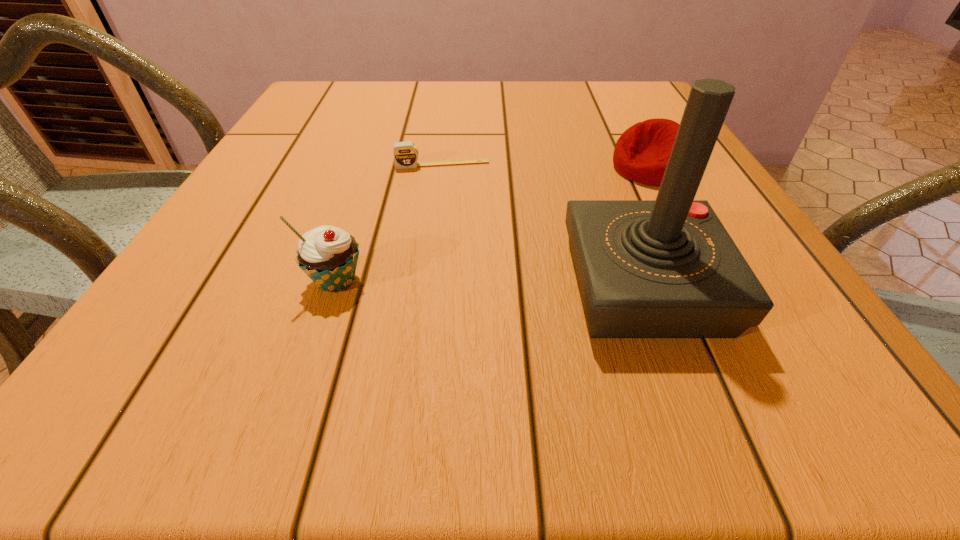
The height and width of the screenshot is (540, 960). I want to click on vacant space at the near edge of the desktop, so click(x=565, y=342).

This screenshot has width=960, height=540. In the image, there is a desktop. Identify the location of vacant space at the left edge. (298, 132).

Locate an element on the screen. free region at the right edge of the desktop is located at coordinates (x=631, y=119).

Image resolution: width=960 pixels, height=540 pixels. Identify the location of vacant region at the far left corner of the desktop. (359, 89).

This screenshot has width=960, height=540. I want to click on free space at the near left corner of the desktop, so click(168, 296).

Identify the location of vacant space that's between the second tallest object and the third tallest object. (493, 224).

Image resolution: width=960 pixels, height=540 pixels. Find the location of `unoccupied area between the third tallest object and the tape measure`. unoccupied area between the third tallest object and the tape measure is located at coordinates (546, 166).

Where is `free space between the tape measure and the beanbag`? The height and width of the screenshot is (540, 960). free space between the tape measure and the beanbag is located at coordinates (546, 166).

Identify the location of empty space between the third shortest object and the shortest object. This screenshot has width=960, height=540. (390, 222).

Locate an element on the screen. The height and width of the screenshot is (540, 960). vacant point located between the second shortest object and the shortest object is located at coordinates (546, 166).